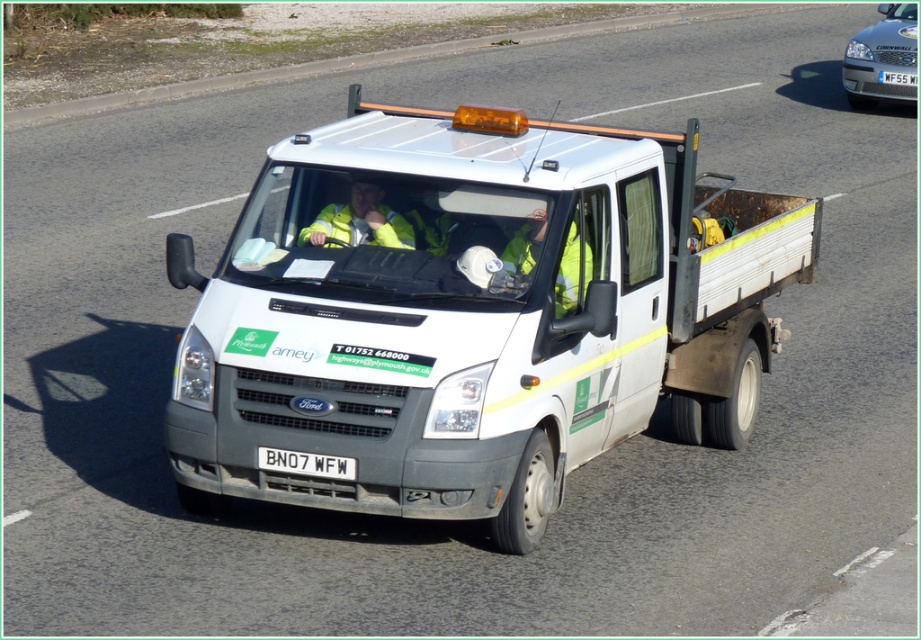
Does yellow reflective vest at center appear on the right side of white plastic license plate at center?

Indeed, yellow reflective vest at center is positioned on the right side of white plastic license plate at center.

Consider the image. Is yellow reflective vest at center below white plastic license plate at center?

No.

Does point (522, 262) lie behind point (334, 458)?

Yes, point (522, 262) is behind point (334, 458).

Locate an element on the screen. This screenshot has height=640, width=921. yellow reflective vest at center is located at coordinates (572, 273).

Image resolution: width=921 pixels, height=640 pixels. Describe the element at coordinates (473, 316) in the screenshot. I see `white matte truck at center` at that location.

Between white matte truck at center and white plastic license plate at center, which one appears on the right side from the viewer's perspective?

white matte truck at center is more to the right.

The width and height of the screenshot is (921, 640). I want to click on white matte truck at center, so click(473, 316).

Is white matte truck at center smaller than yellow reflective safety vest at center?

Actually, white matte truck at center might be larger than yellow reflective safety vest at center.

Is white matte truck at center closer to the viewer compared to yellow reflective safety vest at center?

Yes, it is.

Does point (296, 141) lie in front of point (353, 212)?

No, (296, 141) is further to viewer.

I want to click on white matte truck at center, so click(473, 316).